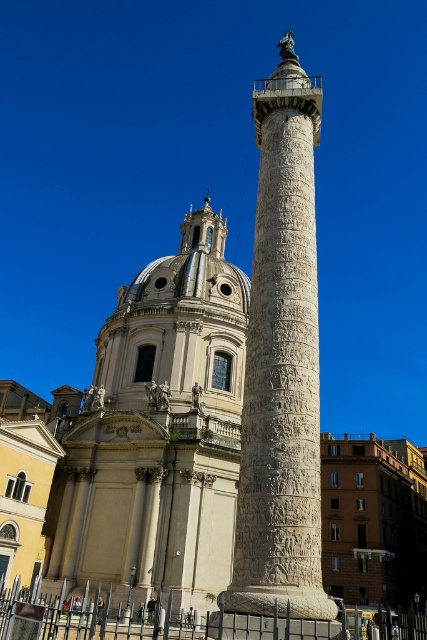
Question: Can you confirm if white marble dome at center is bigger than white stone column at center?

Choices:
 (A) yes
 (B) no

Answer: (B)

Question: Is white marble dome at center thinner than white stone column at center?

Choices:
 (A) yes
 (B) no

Answer: (B)

Question: Which point is farther from the camera taking this photo?

Choices:
 (A) (269, 424)
 (B) (178, 488)

Answer: (B)

Question: Does white marble dome at center appear under white stone column at center?

Choices:
 (A) no
 (B) yes

Answer: (B)

Question: Which of the following is the closest to the observer?

Choices:
 (A) (186, 531)
 (B) (307, 228)

Answer: (B)